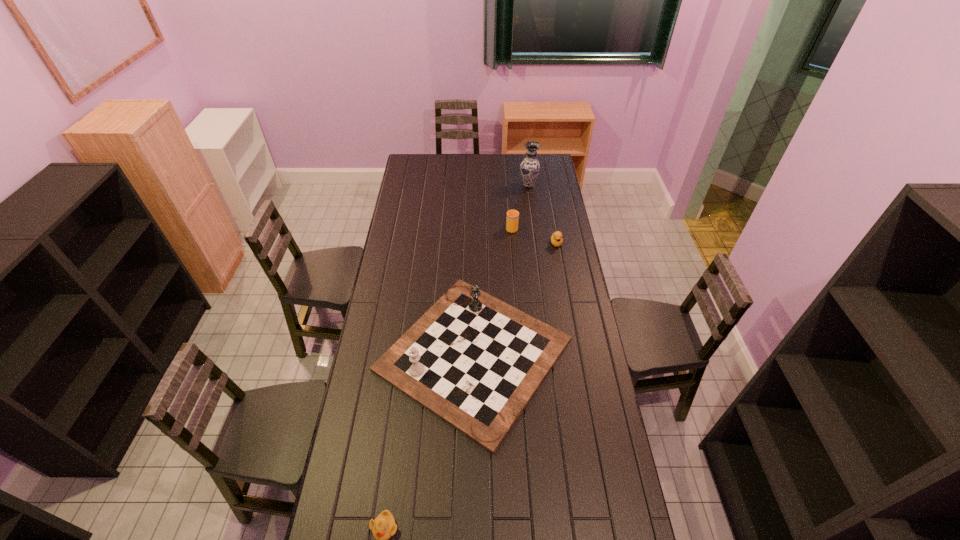
Identify the location of vacant space located 0.180m on the side of the fourth nearest object with the handle. This screenshot has width=960, height=540. (510, 202).

The height and width of the screenshot is (540, 960). Identify the location of free space located on the side of the fourth nearest object with the handle. (508, 183).

Where is `blank area located 0.380m on the side of the fourth nearest object with the handle`? The width and height of the screenshot is (960, 540). blank area located 0.380m on the side of the fourth nearest object with the handle is located at coordinates (508, 182).

The width and height of the screenshot is (960, 540). I want to click on vacant space located on the face of the right duckling, so click(563, 280).

Locate an element on the screen. The height and width of the screenshot is (540, 960). object positioned at the left edge is located at coordinates (474, 361).

This screenshot has width=960, height=540. Identify the location of vase at the right edge. (530, 167).

Find the location of `gameboard present at the right edge`. gameboard present at the right edge is located at coordinates (474, 361).

Find the location of a particular element. duckling located at the right edge is located at coordinates (556, 239).

The width and height of the screenshot is (960, 540). In the image, there is a desktop. What are the coordinates of `free region at the far edge` in the screenshot? It's located at (443, 156).

The image size is (960, 540). I want to click on free region at the left edge of the desktop, so click(349, 489).